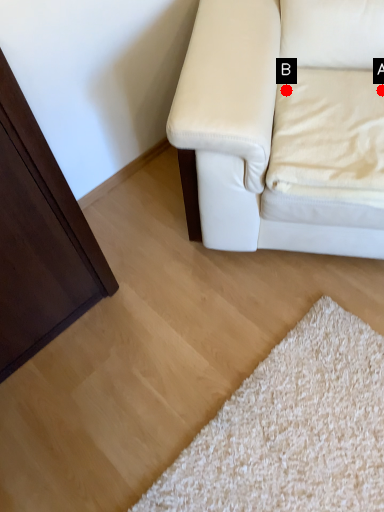
Question: Two points are circled on the image, labeled by A and B beside each circle. Which point is farther to the camera?

Choices:
 (A) A is further
 (B) B is further

Answer: (B)